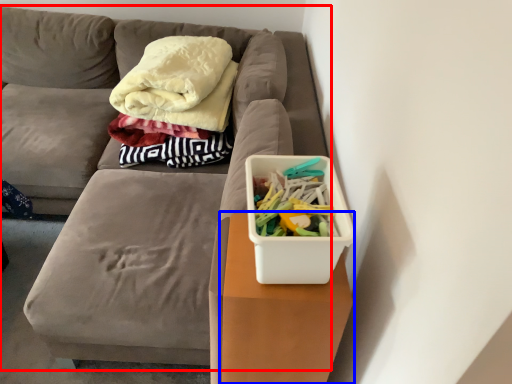
Question: Which object appears closest to the camera in this image, furniture (highlighted by a red box) or table (highlighted by a blue box)?

Choices:
 (A) furniture
 (B) table

Answer: (B)